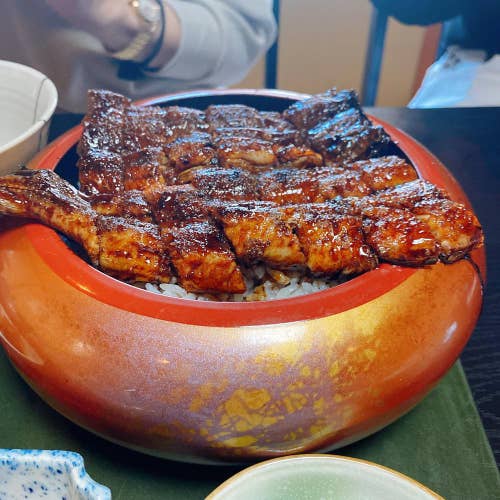
The image size is (500, 500). Identify the location of green mat. (436, 442).